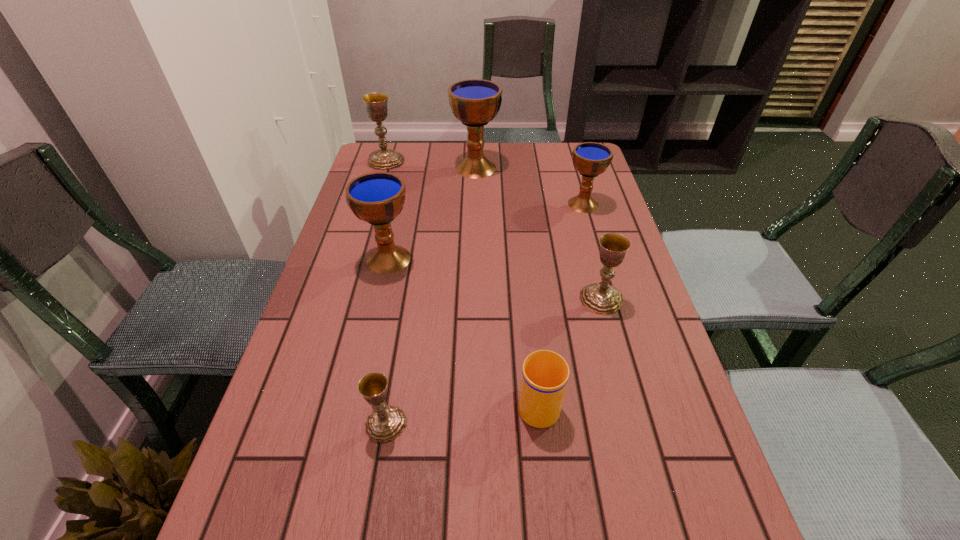
Where is `blue chalice that is the closest one to the nearest blue chalice`? blue chalice that is the closest one to the nearest blue chalice is located at coordinates [475, 102].

This screenshot has width=960, height=540. Find the location of `the closest blue chalice to the fourth object from right to left`. the closest blue chalice to the fourth object from right to left is located at coordinates (590, 159).

Find the location of a particular element. gold chalice that stands as the second closest to the biggest gold chalice is located at coordinates (385, 423).

At what (x,y) coordinates should I click in order to perform the action: click on the second closest gold chalice relative to the leftmost gold chalice. Please return your answer as a coordinate pair (x, y). Image resolution: width=960 pixels, height=540 pixels. Looking at the image, I should click on (385, 423).